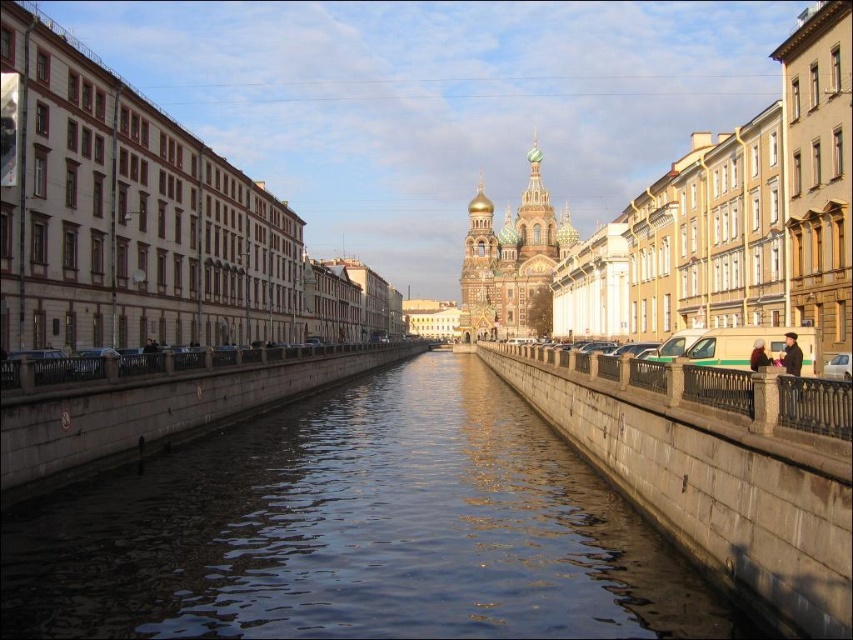
Question: Is smooth concrete water at center to the left of gold domed cathedral at center from the viewer's perspective?

Choices:
 (A) yes
 (B) no

Answer: (A)

Question: Does smooth concrete water at center appear on the right side of gold domed cathedral at center?

Choices:
 (A) no
 (B) yes

Answer: (A)

Question: Among these objects, which one is farthest from the camera?

Choices:
 (A) gold domed cathedral at center
 (B) light brown leather jacket at right
 (C) smooth concrete water at center

Answer: (A)

Question: Among these objects, which one is nearest to the camera?

Choices:
 (A) smooth concrete water at center
 (B) light brown leather jacket at right

Answer: (A)

Question: Among these objects, which one is farthest from the camera?

Choices:
 (A) gold domed cathedral at center
 (B) smooth concrete water at center
 (C) light brown leather jacket at right

Answer: (A)

Question: Is smooth concrete water at center below gold domed cathedral at center?

Choices:
 (A) no
 (B) yes

Answer: (B)